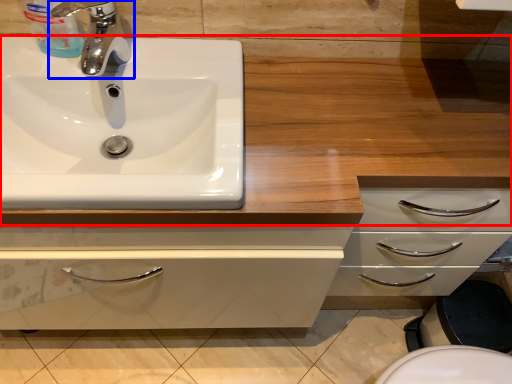
Question: Among these objects, which one is nearest to the camera, counter top (highlighted by a red box) or tap (highlighted by a blue box)?

Choices:
 (A) counter top
 (B) tap

Answer: (A)